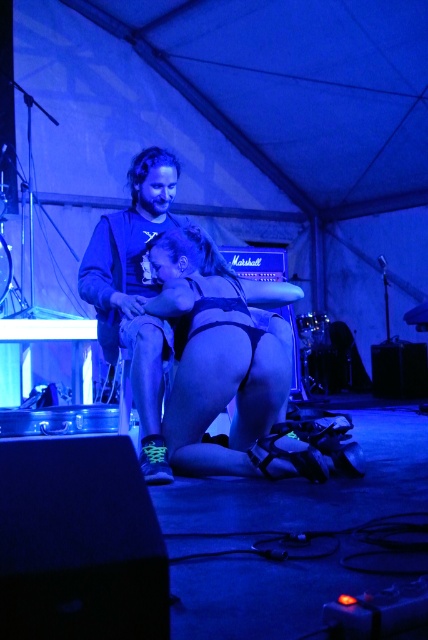
You are a photographer at the event and need to capture a clear shot of both the black matte bikini bottom at center and the matte black shirt at center. Based on their positions, which object will appear closer to the camera in the photo?

The black matte bikini bottom at center is in front of the matte black shirt at center, so it will appear closer to the camera in the photo.

You are standing at the point marked as point (234, 435) in the image. There are two people here. If you want to move closer to the person on the right, which direction should you go?

Since they are 3.21 meters apart, moving towards the person on the right would require going in the direction away from the person on the left.

You are a photographer at the event and need to capture a shot of both the black matte bikini bottom at center and the matte black shirt at center. Based on their positions, which one is located to the right side of the other?

The black matte bikini bottom at center is to the right of the matte black shirt at center.